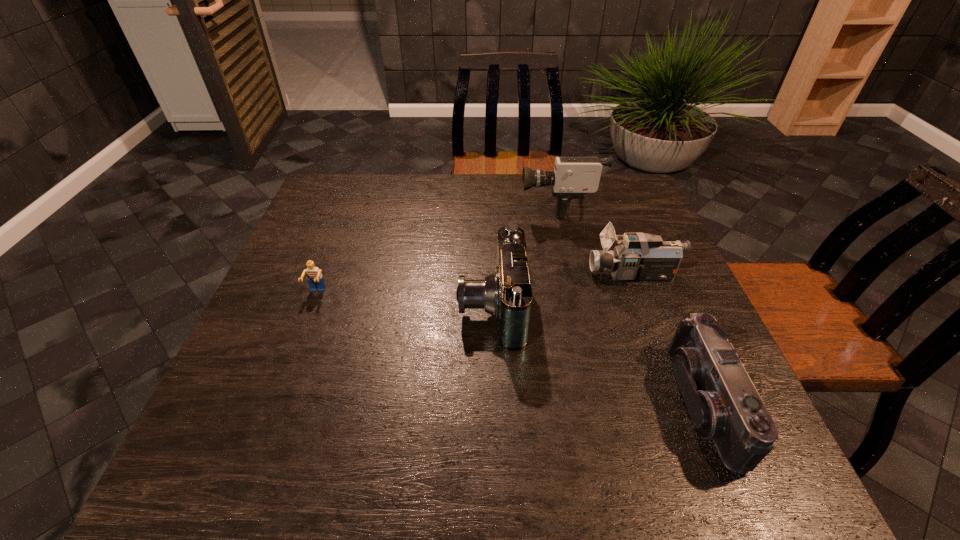
I want to click on camcorder that is the third closest to the leftmost camcorder, so click(723, 404).

Identify the location of vacant point that satisfies the following two spatial constraints: 1. on the recording direction of the farthest object; 2. on the face of the Lego. Image resolution: width=960 pixels, height=540 pixels. (578, 293).

The width and height of the screenshot is (960, 540). In order to click on vacant position in the image that satisfies the following two spatial constraints: 1. on the recording direction of the tallest object; 2. on the face of the Lego in this screenshot , I will do `click(578, 293)`.

This screenshot has width=960, height=540. Identify the location of free region that satisfies the following two spatial constraints: 1. on the recording direction of the tallest camcorder; 2. on the face of the leftmost object. [578, 293].